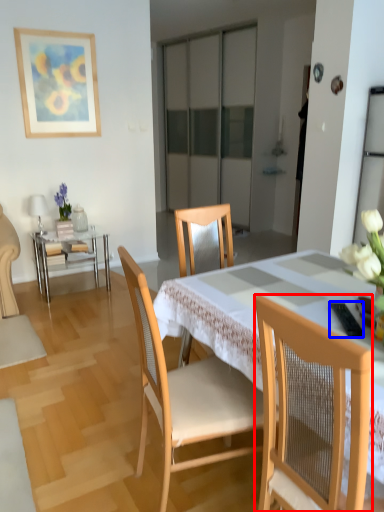
Question: Which of the following is the closest to the observer, chair (highlighted by a red box) or remote control (highlighted by a blue box)?

Choices:
 (A) chair
 (B) remote control

Answer: (A)